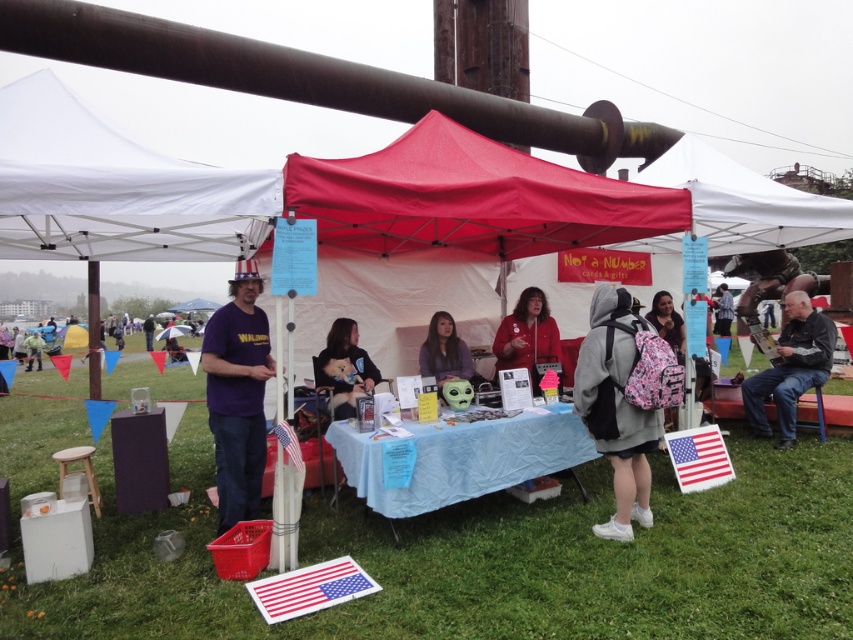
Question: Can you confirm if plaid shirt at center is positioned above matte purple shirt at center?

Choices:
 (A) no
 (B) yes

Answer: (B)

Question: Can you confirm if matte red jacket at center is positioned above matte purple shirt at center?

Choices:
 (A) no
 (B) yes

Answer: (B)

Question: Estimate the real-world distances between objects in this image. Which object is farther from the gray fleece hoodie at center?

Choices:
 (A) red fabric canopy at center
 (B) matte black hair at center

Answer: (B)

Question: In this image, where is blue fabric table at center located relative to purple cotton shirt at center?

Choices:
 (A) below
 (B) above

Answer: (A)

Question: Which of the following is the farthest from the observer?

Choices:
 (A) (782, 353)
 (B) (445, 378)

Answer: (A)

Question: Considering the real-world distances, which object is closest to the matte purple shirt at center?

Choices:
 (A) soft gray sweater at center
 (B) red fabric canopy at center

Answer: (A)